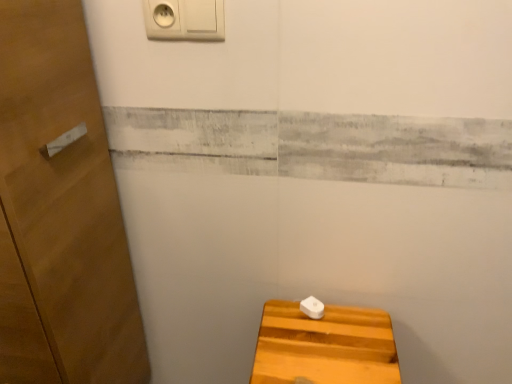
In order to face white plastic/light switch at upper center, should I rotate leftwards or rightwards?

You should rotate left by 9.851 degrees.

Where is `white plastic/light switch at upper center`? The width and height of the screenshot is (512, 384). white plastic/light switch at upper center is located at coordinates (184, 19).

How many degrees apart are the facing directions of white plastic/light switch at upper center and wooden door at left?

There is a 92-degree angle between the facing directions of white plastic/light switch at upper center and wooden door at left.

Is point (149, 8) farther from viewer compared to point (33, 19)?

That is True.

Looking at this image, is white plastic/light switch at upper center spatially inside wooden door at left, or outside of it?

The correct answer is: outside.

Can you confirm if white plastic/light switch at upper center is shorter than wooden door at left?

Yes.

What's the angular difference between white plastic knob at lower center and wooden door at left's facing directions?

white plastic knob at lower center and wooden door at left are facing 91.6 degrees away from each other.

You are a GUI agent. You are given a task and a screenshot of the screen. Output one action in this format:
    pyautogui.click(x=<x>, y=<y>)
    Task: Click on the knob below the wooden door at left (from a real-world perspective)
    The height and width of the screenshot is (384, 512).
    Given the screenshot: What is the action you would take?
    pyautogui.click(x=312, y=307)

Could wooden door at left be considered to be inside white plastic knob at lower center?

No, wooden door at left is not inside white plastic knob at lower center.

The image size is (512, 384). Find the location of `light switch on the left side of white plastic knob at lower center`. light switch on the left side of white plastic knob at lower center is located at coordinates (184, 19).

From the picture: From a real-world perspective, is white plastic/light switch at upper center located beneath white plastic knob at lower center?

No, from a real-world perspective, white plastic/light switch at upper center is not below white plastic knob at lower center.

Can you tell me how much white plastic/light switch at upper center and white plastic knob at lower center differ in facing direction?

The angular difference between white plastic/light switch at upper center and white plastic knob at lower center is 0.441 degrees.

Considering the sizes of white plastic/light switch at upper center and white plastic knob at lower center in the image, is white plastic/light switch at upper center taller or shorter than white plastic knob at lower center?

In the image, white plastic/light switch at upper center appears to be taller than white plastic knob at lower center.

Is white plastic/light switch at upper center smaller than light brown wooden stool at lower right?

Indeed, white plastic/light switch at upper center has a smaller size compared to light brown wooden stool at lower right.

How many degrees apart are the facing directions of white plastic/light switch at upper center and light brown wooden stool at lower right?

white plastic/light switch at upper center and light brown wooden stool at lower right are facing 0.44 degrees away from each other.

Is white plastic/light switch at upper center taller or shorter than light brown wooden stool at lower right?

Clearly, white plastic/light switch at upper center is shorter compared to light brown wooden stool at lower right.

From a real-world perspective, who is located higher, white plastic/light switch at upper center or light brown wooden stool at lower right?

In real-world perspective, white plastic/light switch at upper center is above.

Does point (328, 321) come farther from viewer compared to point (313, 304)?

That is False.

Is light brown wooden stool at lower right far from white plastic knob at lower center?

Actually, light brown wooden stool at lower right and white plastic knob at lower center are a little close together.

Which of these two, light brown wooden stool at lower right or white plastic knob at lower center, stands shorter?

white plastic knob at lower center.

From the image's perspective, which is below, light brown wooden stool at lower right or white plastic knob at lower center?

From the image's view, light brown wooden stool at lower right is below.

Looking at their sizes, would you say light brown wooden stool at lower right is wider or thinner than wooden door at left?

light brown wooden stool at lower right is thinner than wooden door at left.

From the image's perspective, which is above, light brown wooden stool at lower right or wooden door at left?

wooden door at left.

Considering the relative sizes of light brown wooden stool at lower right and wooden door at left in the image provided, is light brown wooden stool at lower right shorter than wooden door at left?

Yes, light brown wooden stool at lower right is shorter than wooden door at left.

Considering the positions of point (307, 314) and point (221, 16), is point (307, 314) closer or farther from the camera than point (221, 16)?

Point (307, 314) appears to be farther away from the viewer than point (221, 16).

In terms of size, does white plastic knob at lower center appear bigger or smaller than white plastic/light switch at upper center?

white plastic knob at lower center is smaller than white plastic/light switch at upper center.

From the image's perspective, is white plastic knob at lower center located above or below white plastic/light switch at upper center?

From the image's perspective, white plastic knob at lower center appears below white plastic/light switch at upper center.

Identify the location of door that is in front of the white plastic/light switch at upper center. (60, 212).

The width and height of the screenshot is (512, 384). Identify the location of door located above the white plastic knob at lower center (from the image's perspective). (60, 212).

Based on their spatial positions, is wooden door at left or white plastic knob at lower center further from light brown wooden stool at lower right?

The object further to light brown wooden stool at lower right is wooden door at left.

Which object lies nearer to the anchor point white plastic/light switch at upper center, white plastic knob at lower center or light brown wooden stool at lower right?

white plastic knob at lower center is closer to white plastic/light switch at upper center.

Based on their spatial positions, is white plastic/light switch at upper center or wooden door at left closer to white plastic knob at lower center?

Based on the image, wooden door at left appears to be nearer to white plastic knob at lower center.

Based on their spatial positions, is white plastic knob at lower center or wooden door at left further from light brown wooden stool at lower right?

wooden door at left.

From the image, which object appears to be farther from white plastic knob at lower center, wooden door at left or white plastic/light switch at upper center?

Among the two, white plastic/light switch at upper center is located further to white plastic knob at lower center.

Looking at the image, which one is located closer to light brown wooden stool at lower right, white plastic/light switch at upper center or wooden door at left?

wooden door at left is positioned closer to the anchor light brown wooden stool at lower right.

Which object lies further to the anchor point wooden door at left, white plastic/light switch at upper center or light brown wooden stool at lower right?

The object further to wooden door at left is light brown wooden stool at lower right.

Looking at the image, which one is located further to white plastic knob at lower center, light brown wooden stool at lower right or white plastic/light switch at upper center?

Answer: white plastic/light switch at upper center lies further to white plastic knob at lower center than the other object.

Identify the location of knob between white plastic/light switch at upper center and light brown wooden stool at lower right in the vertical direction. click(312, 307).

The width and height of the screenshot is (512, 384). Find the location of `door that lies between white plastic/light switch at upper center and light brown wooden stool at lower right from top to bottom`. door that lies between white plastic/light switch at upper center and light brown wooden stool at lower right from top to bottom is located at coordinates (60, 212).

Image resolution: width=512 pixels, height=384 pixels. What are the coordinates of `knob between wooden door at left and light brown wooden stool at lower right in the horizontal direction` in the screenshot? It's located at click(312, 307).

You are a GUI agent. You are given a task and a screenshot of the screen. Output one action in this format:
    pyautogui.click(x=<x>, y=<y>)
    Task: Click on the door between white plastic/light switch at upper center and white plastic knob at lower center vertically
    The image size is (512, 384).
    Given the screenshot: What is the action you would take?
    pyautogui.click(x=60, y=212)